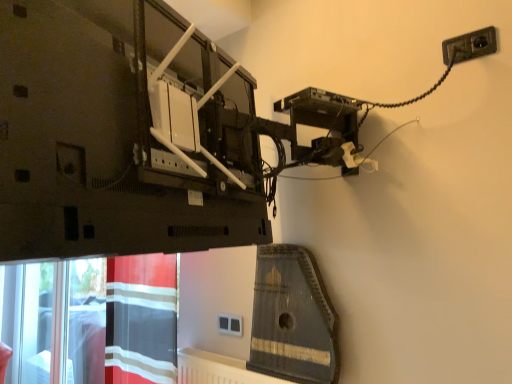
Question: Should I look upward or downward to see red striped fabric at lower left?

Choices:
 (A) up
 (B) down

Answer: (B)

Question: Is white plastic socket at center directly adjacent to wooden harp at center?

Choices:
 (A) no
 (B) yes

Answer: (A)

Question: Considering the relative sizes of white plastic socket at center and wooden harp at center in the image provided, is white plastic socket at center bigger than wooden harp at center?

Choices:
 (A) yes
 (B) no

Answer: (B)

Question: Considering the relative sizes of white plastic socket at center and wooden harp at center in the image provided, is white plastic socket at center wider than wooden harp at center?

Choices:
 (A) no
 (B) yes

Answer: (A)

Question: Considering the relative sizes of white plastic socket at center and wooden harp at center in the image provided, is white plastic socket at center smaller than wooden harp at center?

Choices:
 (A) no
 (B) yes

Answer: (B)

Question: Is white plastic socket at center completely or partially outside of wooden harp at center?

Choices:
 (A) yes
 (B) no

Answer: (A)

Question: Is white plastic socket at center not near wooden harp at center?

Choices:
 (A) yes
 (B) no

Answer: (B)

Question: Is wooden harp at center taller than red striped fabric at lower left?

Choices:
 (A) no
 (B) yes

Answer: (A)

Question: From the image's perspective, does wooden harp at center appear lower than red striped fabric at lower left?

Choices:
 (A) no
 (B) yes

Answer: (A)

Question: Is wooden harp at center bigger than red striped fabric at lower left?

Choices:
 (A) no
 (B) yes

Answer: (A)

Question: Is wooden harp at center to the right of red striped fabric at lower left from the viewer's perspective?

Choices:
 (A) no
 (B) yes

Answer: (B)

Question: From the image's perspective, is wooden harp at center located above red striped fabric at lower left?

Choices:
 (A) no
 (B) yes

Answer: (B)

Question: From a real-world perspective, is wooden harp at center positioned over red striped fabric at lower left based on gravity?

Choices:
 (A) yes
 (B) no

Answer: (A)

Question: Is black plastic socket at upper right wider than wooden harp at center?

Choices:
 (A) no
 (B) yes

Answer: (A)